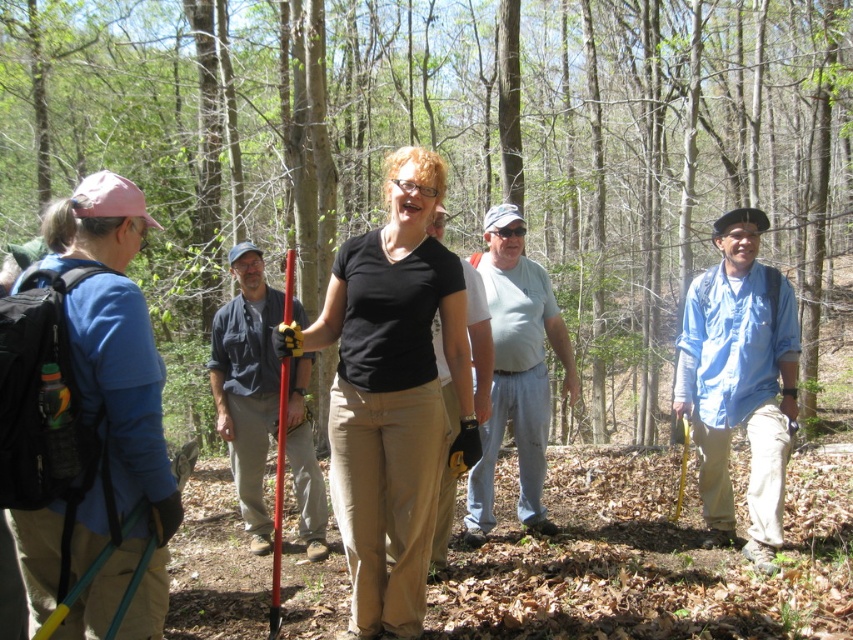
Question: Does black matte shirt at center have a smaller size compared to light blue t-shirt at center?

Choices:
 (A) yes
 (B) no

Answer: (A)

Question: Which object is the farthest from the black cotton shirt at center?

Choices:
 (A) black matte shirt at center
 (B) matte red pole at center
 (C) blue cotton shirt at right

Answer: (C)

Question: Estimate the real-world distances between objects in this image. Which object is farther from the black cotton shirt at center?

Choices:
 (A) matte red pole at center
 (B) black matte shirt at center

Answer: (A)

Question: In this image, where is matte red pole at center located relative to black cotton shirt at center?

Choices:
 (A) right
 (B) left

Answer: (B)

Question: Is green leafy tree at center below light blue t-shirt at center?

Choices:
 (A) no
 (B) yes

Answer: (A)

Question: Estimate the real-world distances between objects in this image. Which object is farther from the green leafy tree at center?

Choices:
 (A) black matte shirt at center
 (B) matte red pole at center
 (C) light blue t-shirt at center
 (D) black cotton shirt at center

Answer: (A)